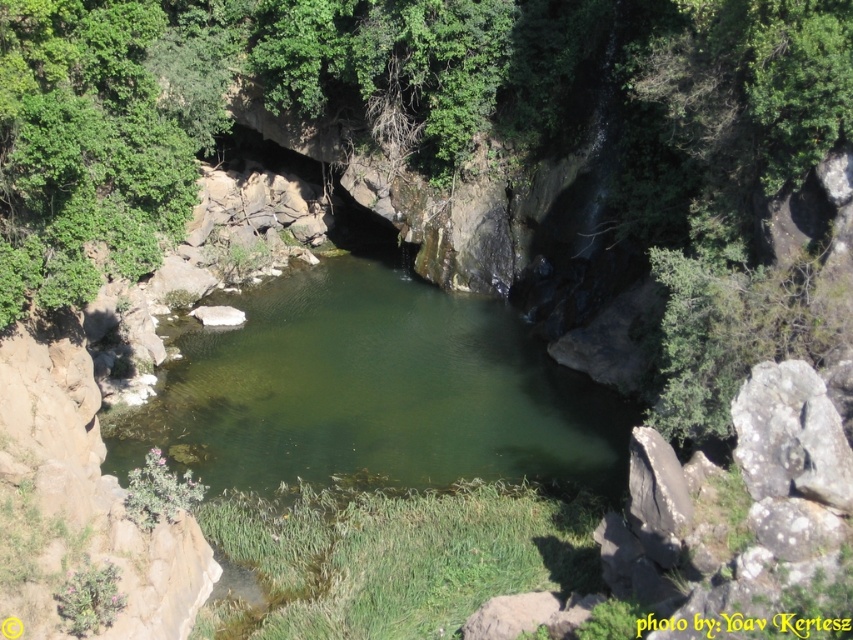
Question: Does green smooth water at center have a smaller size compared to gray rough rock at lower right?

Choices:
 (A) no
 (B) yes

Answer: (A)

Question: Among these points, which one is farthest from the camera?

Choices:
 (A) (445, 474)
 (B) (663, 502)

Answer: (A)

Question: Does green smooth water at center have a smaller size compared to gray rough rock at right?

Choices:
 (A) no
 (B) yes

Answer: (A)

Question: Is gray rough rock at right smaller than gray rough rock at lower right?

Choices:
 (A) no
 (B) yes

Answer: (A)

Question: Which of these objects is positioned closest to the gray rough rock at right?

Choices:
 (A) green smooth water at center
 (B) gray rough rock at lower right

Answer: (B)

Question: Which of the following is the farthest from the observer?

Choices:
 (A) (674, 515)
 (B) (838, 420)

Answer: (A)